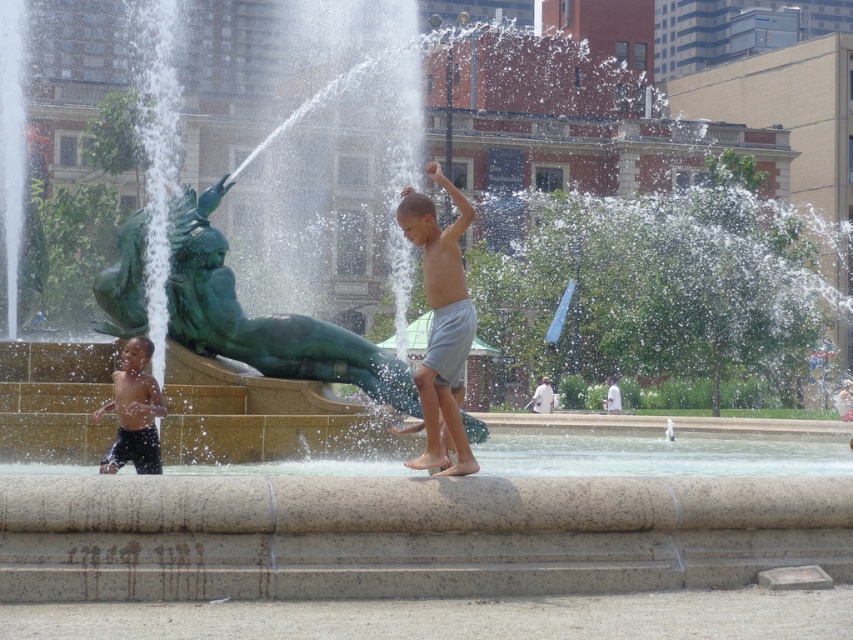
You are a photographer trying to capture the exact position of the gray cotton shorts at center in this fountain scene. According to the coordinates provided, where would you position your camera to ensure the shorts are centered in your shot?

The gray cotton shorts at center are located at coordinates point (440, 323), so positioning the camera to center on these coordinates would ensure the shorts are centered in the shot.

You are a photographer trying to capture both children in the same frame. Since the gray cotton shorts at center and the matte black shorts at lower left are positioned differently, which direction should you move your camera to include both?

Since the gray cotton shorts at center is to the right of matte black shorts at lower left, you should move your camera to the left to include both.

From the picture: You are a photographer standing at the edge of the fountain. You want to capture a photo that includes both the gray cotton shorts at center and the matte black shorts at lower left. Given the distance between them, will you need to adjust your camera lens to a wider angle to ensure both are in frame?

The gray cotton shorts at center is 13.72 feet from the matte black shorts at lower left. To include both in the frame, you would need to use a wider angle lens to accommodate the distance between them.